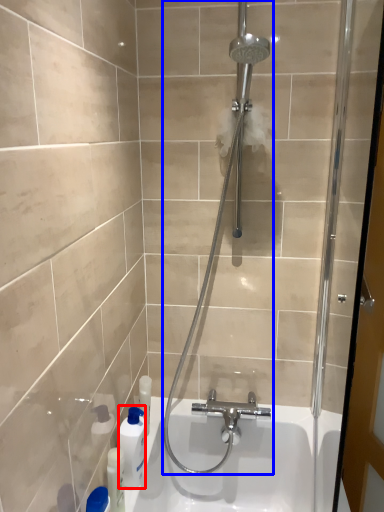
Question: Which object is further to the camera taking this photo, cleaning product (highlighted by a red box) or shower (highlighted by a blue box)?

Choices:
 (A) cleaning product
 (B) shower

Answer: (A)